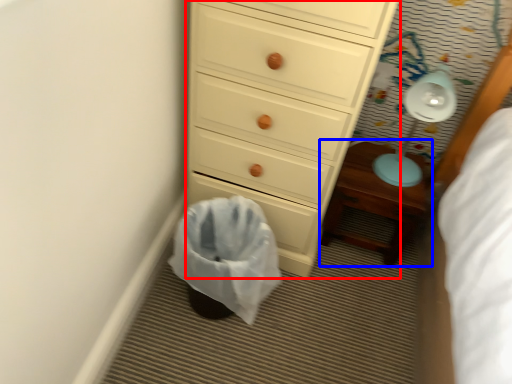
Question: Which object appears farthest to the camera in this image, chest of drawers (highlighted by a red box) or nightstand (highlighted by a blue box)?

Choices:
 (A) chest of drawers
 (B) nightstand

Answer: (B)